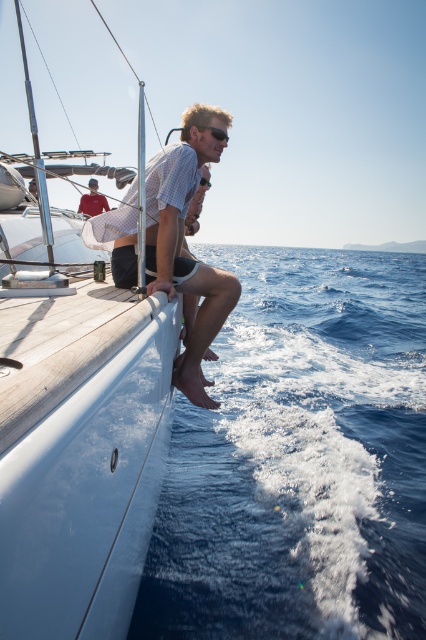
Does blue water at lower right appear under matte red shirt at upper left?

Correct, blue water at lower right is located below matte red shirt at upper left.

Identify the location of blue water at lower right. (299, 460).

Can you confirm if blue water at lower right is positioned to the left of white glossy boat at left?

In fact, blue water at lower right is to the right of white glossy boat at left.

Which is behind, point (262, 364) or point (94, 328)?

The point (262, 364) is behind.

Which is in front, point (199, 632) or point (149, 435)?

Positioned in front is point (149, 435).

Locate an element on the screen. The image size is (426, 640). blue water at lower right is located at coordinates (299, 460).

Does white glossy boat at left appear under light brown wood man at center?

Indeed, white glossy boat at left is positioned under light brown wood man at center.

Is white glossy boat at left thinner than light brown wood man at center?

Yes, white glossy boat at left is thinner than light brown wood man at center.

What do you see at coordinates (80, 456) in the screenshot?
I see `white glossy boat at left` at bounding box center [80, 456].

This screenshot has width=426, height=640. Identify the location of white glossy boat at left. (80, 456).